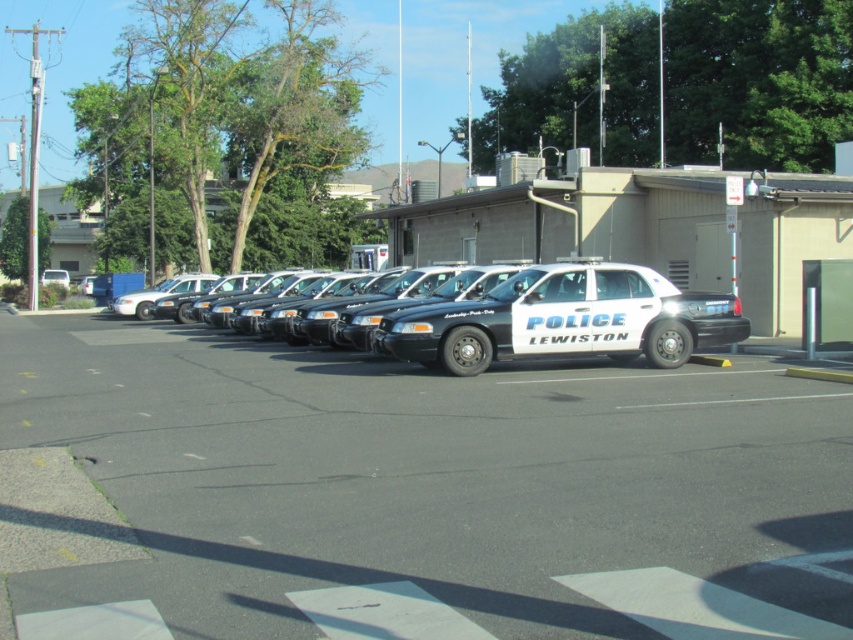
Consider the image. Who is more distant from viewer, (10, 362) or (453, 314)?

The point (10, 362) is behind.

Which of these two, white glossy police car at center or black glossy police car at center, stands taller?

Standing taller between the two is black glossy police car at center.

Where is `white glossy police car at center`? The width and height of the screenshot is (853, 640). white glossy police car at center is located at coordinates (438, 490).